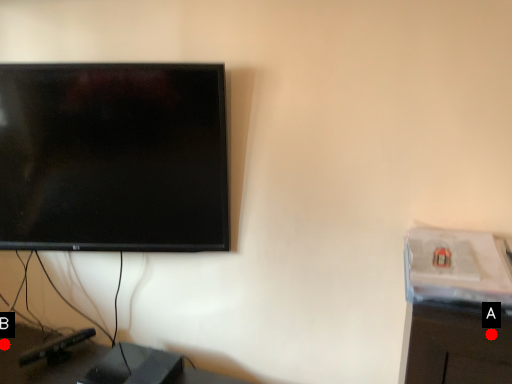
Question: Two points are circled on the image, labeled by A and B beside each circle. Which point appears farthest from the camera in this image?

Choices:
 (A) A is further
 (B) B is further

Answer: (B)